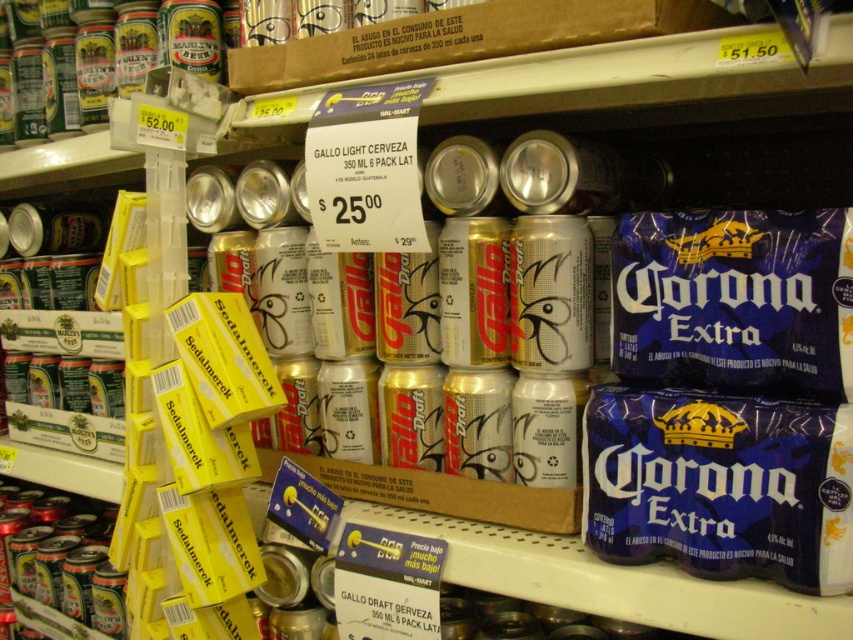
Which is above, gold metallic can at upper center or gold metallic can at center?

Positioned higher is gold metallic can at upper center.

This screenshot has height=640, width=853. What do you see at coordinates (154, 48) in the screenshot?
I see `gold metallic can at upper center` at bounding box center [154, 48].

The height and width of the screenshot is (640, 853). Identify the location of gold metallic can at upper center. (154, 48).

Locate an element on the screen. The image size is (853, 640). gold metallic can at upper center is located at coordinates (154, 48).

How much distance is there between silver metallic cans at center and gold metallic can at upper center?

silver metallic cans at center is 10.88 inches from gold metallic can at upper center.

Who is taller, silver metallic cans at center or gold metallic can at upper center?

silver metallic cans at center

Does point (495, 216) lie in front of point (431, 10)?

No, it is not.

Identify the location of silver metallic cans at center. (505, 264).

Which is more to the left, gold metallic can at upper center or shiny silver can at center?

Positioned to the left is shiny silver can at center.

Can you confirm if gold metallic can at upper center is wider than shiny silver can at center?

Yes, gold metallic can at upper center is wider than shiny silver can at center.

You are a GUI agent. You are given a task and a screenshot of the screen. Output one action in this format:
    pyautogui.click(x=<x>, y=<y>)
    Task: Click on the gold metallic can at upper center
    This screenshot has width=853, height=640.
    Given the screenshot: What is the action you would take?
    pyautogui.click(x=154, y=48)